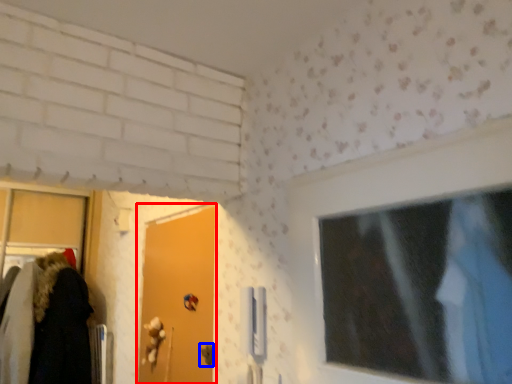
Question: Which point is closer to the camera, door (highlighted by a red box) or door handle (highlighted by a blue box)?

Choices:
 (A) door
 (B) door handle

Answer: (A)